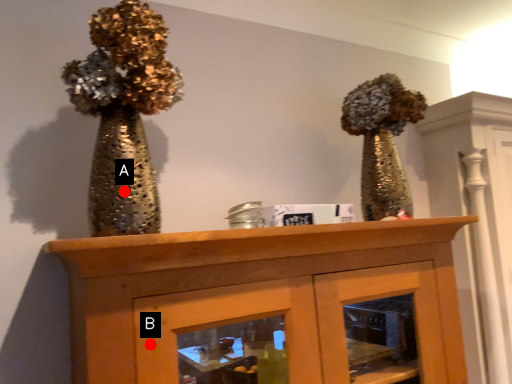
Question: Two points are circled on the image, labeled by A and B beside each circle. Which point is further to the camera?

Choices:
 (A) A is further
 (B) B is further

Answer: (A)